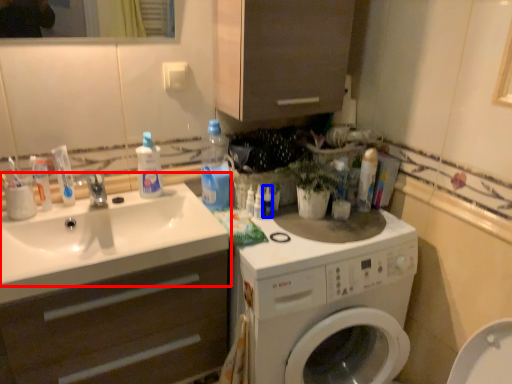
Question: Which object appears closest to the camera in this image, sink (highlighted by a red box) or toiletry (highlighted by a blue box)?

Choices:
 (A) sink
 (B) toiletry

Answer: (A)